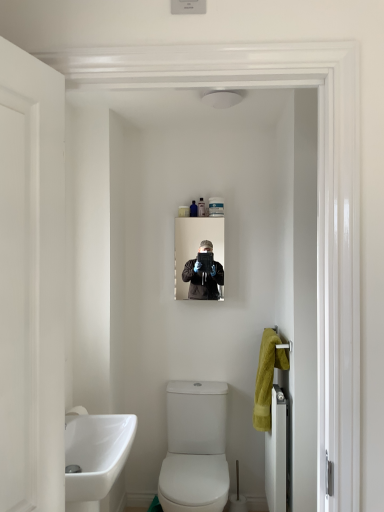
Question: Does clear plastic container at upper center, the 4th toiletry from the left, have a greater height compared to translucent plastic container at upper center, the third toiletry when ordered from left to right?

Choices:
 (A) yes
 (B) no

Answer: (B)

Question: Can you confirm if clear plastic container at upper center, the 4th toiletry from the left, is thinner than translucent plastic container at upper center, placed as the second toiletry when sorted from right to left?

Choices:
 (A) yes
 (B) no

Answer: (B)

Question: Can we say clear plastic container at upper center, placed as the first toiletry when sorted from right to left, lies outside translucent plastic container at upper center, placed as the second toiletry when sorted from right to left?

Choices:
 (A) no
 (B) yes

Answer: (B)

Question: Is clear plastic container at upper center, placed as the first toiletry when sorted from right to left, looking in the opposite direction of translucent plastic container at upper center, the third toiletry when ordered from left to right?

Choices:
 (A) no
 (B) yes

Answer: (A)

Question: From a real-world perspective, is clear plastic container at upper center, placed as the first toiletry when sorted from right to left, below translucent plastic container at upper center, the third toiletry when ordered from left to right?

Choices:
 (A) yes
 (B) no

Answer: (A)

Question: Is clear plastic container at upper center, placed as the first toiletry when sorted from right to left, further to camera compared to translucent plastic container at upper center, placed as the second toiletry when sorted from right to left?

Choices:
 (A) no
 (B) yes

Answer: (A)

Question: Does yellow soft towel at right have a greater height compared to translucent plastic container at upper center, the third toiletry when ordered from left to right?

Choices:
 (A) no
 (B) yes

Answer: (B)

Question: Is yellow soft towel at right to the left of translucent plastic container at upper center, the third toiletry when ordered from left to right, from the viewer's perspective?

Choices:
 (A) no
 (B) yes

Answer: (A)

Question: Is yellow soft towel at right oriented towards translucent plastic container at upper center, the third toiletry when ordered from left to right?

Choices:
 (A) no
 (B) yes

Answer: (A)

Question: From a real-world perspective, is yellow soft towel at right located beneath translucent plastic container at upper center, placed as the second toiletry when sorted from right to left?

Choices:
 (A) yes
 (B) no

Answer: (A)

Question: Is yellow soft towel at right outside of translucent plastic container at upper center, the third toiletry when ordered from left to right?

Choices:
 (A) yes
 (B) no

Answer: (A)

Question: Is translucent plastic container at upper center, placed as the second toiletry when sorted from right to left, inside yellow soft towel at right?

Choices:
 (A) yes
 (B) no

Answer: (B)

Question: Considering the relative sizes of white glossy towel rack at right, which appears as the first door when viewed from the right, and white matte door at left, positioned as the 2th door in back-to-front order, in the image provided, is white glossy towel rack at right, which appears as the first door when viewed from the right, shorter than white matte door at left, positioned as the 2th door in back-to-front order,?

Choices:
 (A) no
 (B) yes

Answer: (B)